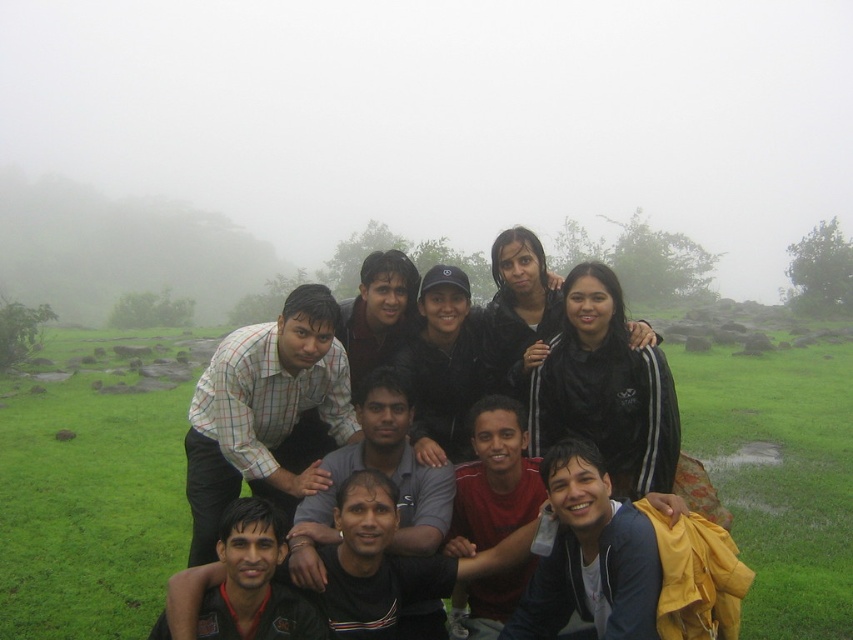
You are a photographer trying to capture a clear shot of the white checkered shirt at center. However, the foggy misty mountain at upper left is obstructing your view. Can you adjust your camera angle to avoid the mountain while still keeping the shirt in the frame?

The foggy misty mountain at upper left is positioned over the white checkered shirt at center, so adjusting the camera angle downward or to the right might help avoid the mountain while keeping the shirt in the frame.

You are standing in the scene and want to walk towards the foggy misty mountain at upper left. Which direction should you move relative to the green grass at lower center?

You should move to the left of the green grass at lower center to head toward the foggy misty mountain at upper left.